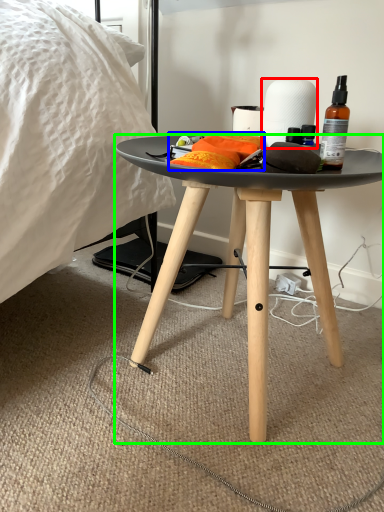
Question: Based on their relative distances, which object is nearer to paper towel (highlighted by a red box)? Choose from material (highlighted by a blue box) and desk (highlighted by a green box).

Choices:
 (A) material
 (B) desk

Answer: (A)